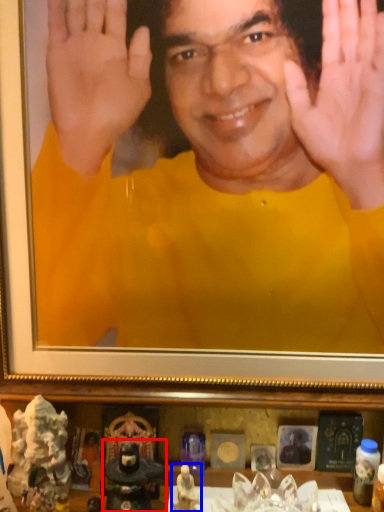
Question: Which object appears farthest to the camera in this image, figurine (highlighted by a red box) or toy (highlighted by a blue box)?

Choices:
 (A) figurine
 (B) toy

Answer: (A)